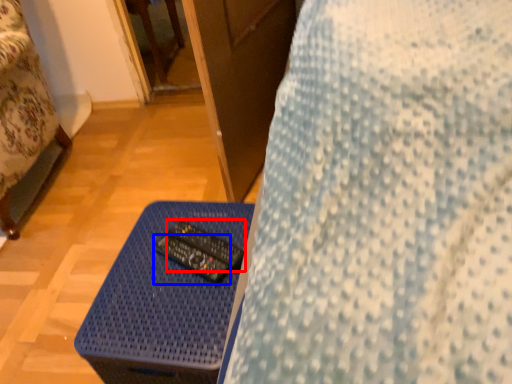
Question: Which object is further to the camera taking this photo, control (highlighted by a red box) or control (highlighted by a blue box)?

Choices:
 (A) control
 (B) control

Answer: (A)